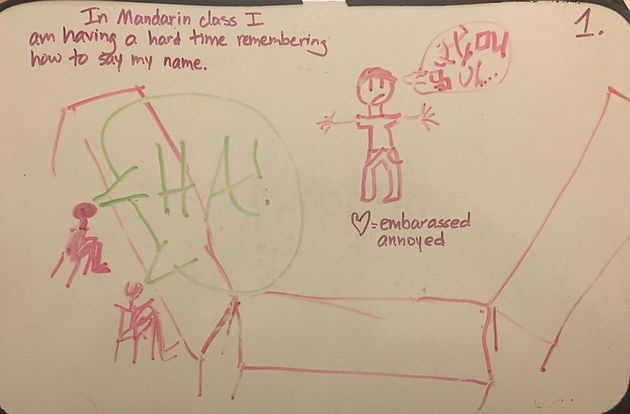
Identify the location of chair. (133, 339), (74, 267).